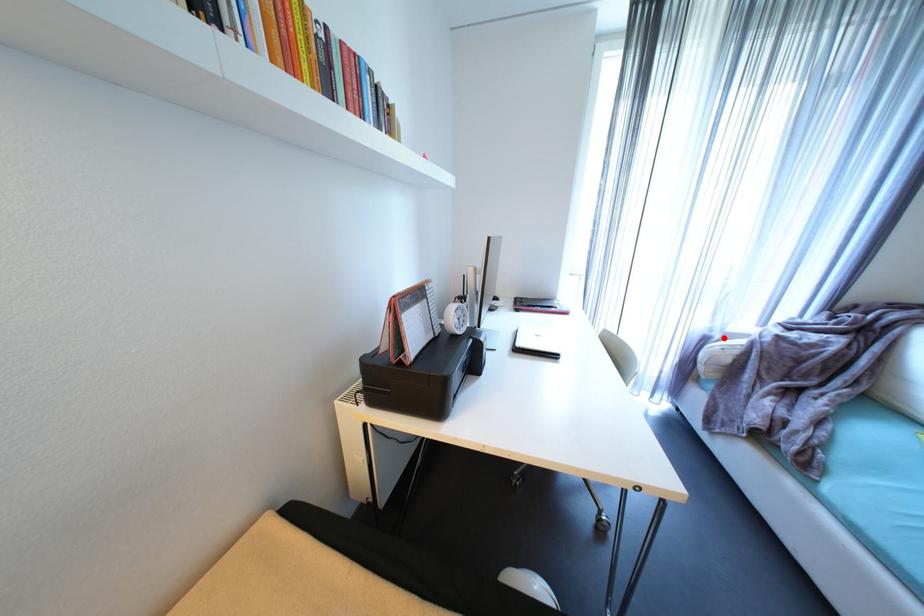
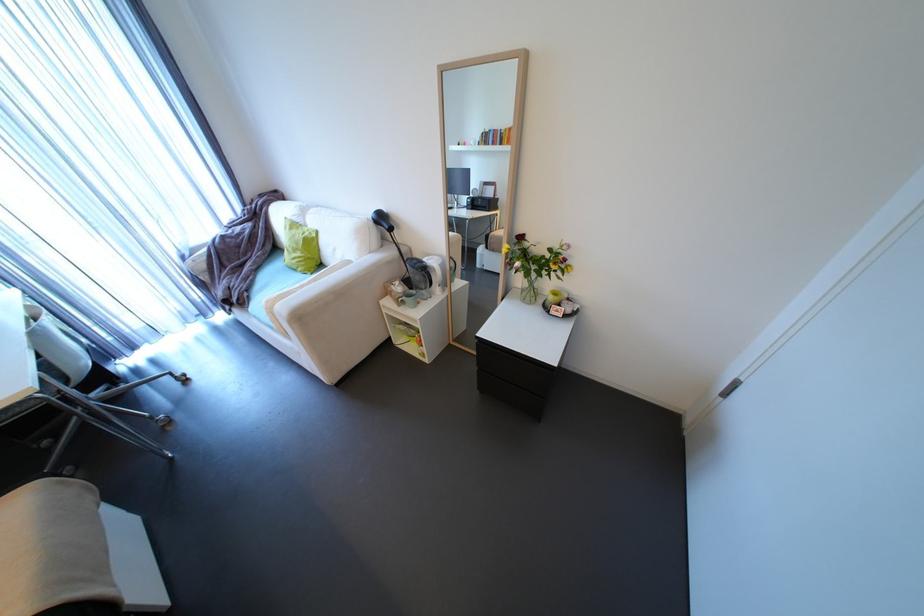
Find the pixel in the second image that matches the highlighted location in the first image.

(195, 254)